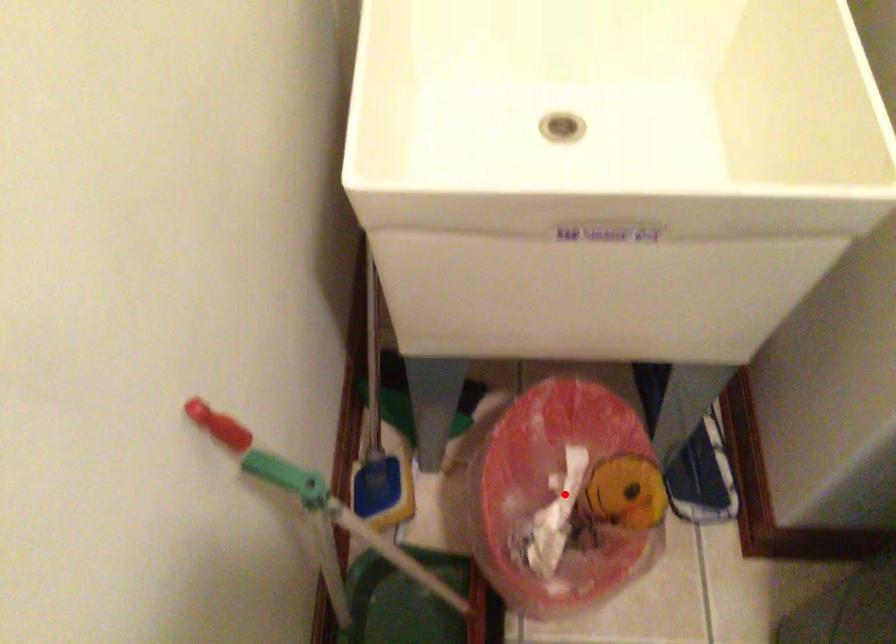
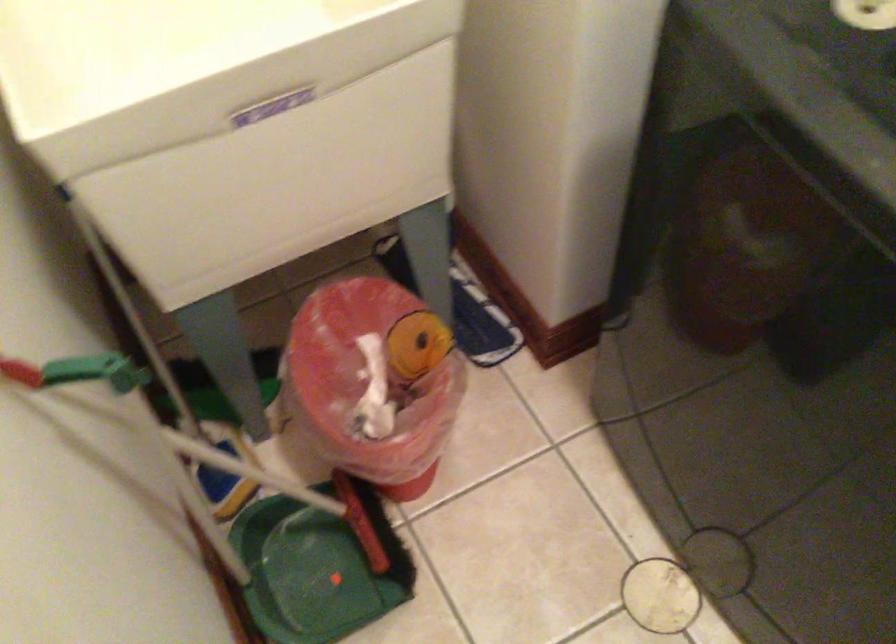
Locate, in the second image, the point that corresponds to the highlighted location in the first image.

(375, 377)